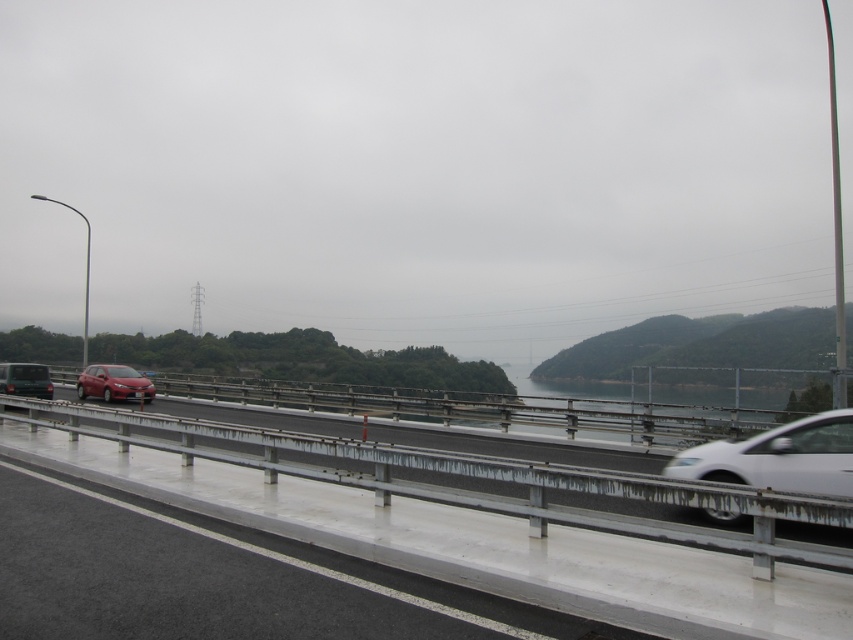
You are a delivery driver who needs to pass through the highway scene shown. You see the white concrete barrier at center and the satin silver sedan at right. Which object is closer to the left edge of the road?

The white concrete barrier at center is positioned on the left side of the satin silver sedan at right, so it is closer to the left edge of the road.